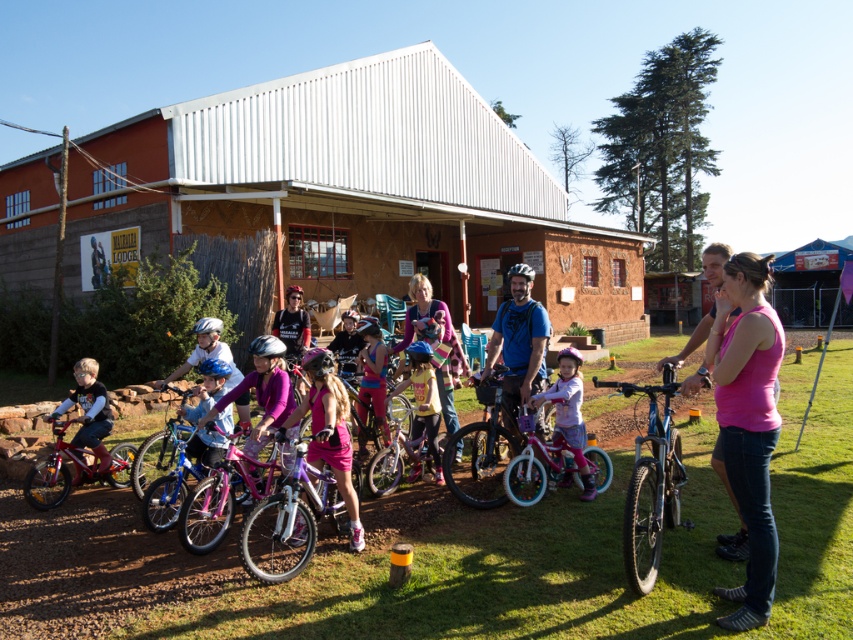
Question: Where is pink fabric shirt at center located in relation to pink matte bicycle at center in the image?

Choices:
 (A) above
 (B) below

Answer: (A)

Question: Does blue matte helmet at center have a lesser width compared to shiny red bicycle at left?

Choices:
 (A) no
 (B) yes

Answer: (B)

Question: Among these objects, which one is nearest to the camera?

Choices:
 (A) purple matte bicycle at center
 (B) pink metallic bicycle at center
 (C) blue matte helmet at center

Answer: (A)

Question: Among these objects, which one is farthest from the camera?

Choices:
 (A) purple matte bicycle at center
 (B) shiny metallic bicycle at center
 (C) pink metallic bicycle at center
 (D) pink matte bicycle at center

Answer: (D)

Question: Does shiny pink bicycle at center have a greater width compared to pink fabric shirt at center?

Choices:
 (A) no
 (B) yes

Answer: (A)

Question: Which object is farther from the camera taking this photo?

Choices:
 (A) blue matte helmet at center
 (B) shiny pink bicycle at center

Answer: (A)